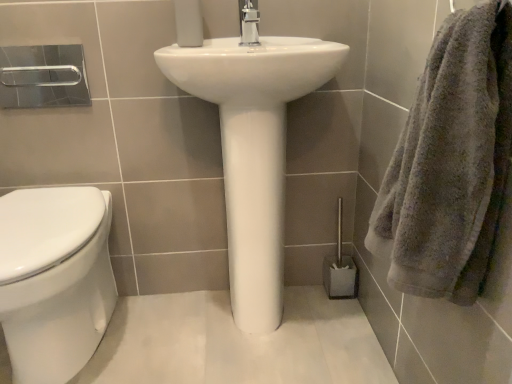
Question: Is white matte toilet paper at upper center behind white glossy toilet at left?

Choices:
 (A) yes
 (B) no

Answer: (A)

Question: Considering the relative sizes of white matte toilet paper at upper center and white glossy toilet at left in the image provided, is white matte toilet paper at upper center wider than white glossy toilet at left?

Choices:
 (A) no
 (B) yes

Answer: (A)

Question: Does white matte toilet paper at upper center turn towards white glossy toilet at left?

Choices:
 (A) yes
 (B) no

Answer: (B)

Question: From a real-world perspective, is white matte toilet paper at upper center positioned under white glossy toilet at left based on gravity?

Choices:
 (A) yes
 (B) no

Answer: (B)

Question: Considering the relative sizes of white matte toilet paper at upper center and white glossy toilet at left in the image provided, is white matte toilet paper at upper center smaller than white glossy toilet at left?

Choices:
 (A) no
 (B) yes

Answer: (B)

Question: Is point (506, 105) closer or farther from the camera than point (329, 283)?

Choices:
 (A) farther
 (B) closer

Answer: (B)

Question: From a real-world perspective, is gray fluffy towel at right physically located above or below gray plastic toilet brush at lower right?

Choices:
 (A) above
 (B) below

Answer: (A)

Question: From their relative heights in the image, would you say gray fluffy towel at right is taller or shorter than gray plastic toilet brush at lower right?

Choices:
 (A) short
 (B) tall

Answer: (B)

Question: From the image's perspective, is gray fluffy towel at right positioned above or below gray plastic toilet brush at lower right?

Choices:
 (A) above
 (B) below

Answer: (A)

Question: Is point (278, 278) closer or farther from the camera than point (420, 218)?

Choices:
 (A) farther
 (B) closer

Answer: (A)

Question: Which is correct: white glossy sink at center is inside gray fluffy towel at right, or outside of it?

Choices:
 (A) outside
 (B) inside

Answer: (A)

Question: Considering the positions of white glossy sink at center and gray fluffy towel at right in the image, is white glossy sink at center taller or shorter than gray fluffy towel at right?

Choices:
 (A) tall
 (B) short

Answer: (A)

Question: From a real-world perspective, relative to gray fluffy towel at right, is white glossy sink at center vertically above or below?

Choices:
 (A) below
 (B) above

Answer: (A)

Question: In terms of width, does white glossy toilet at left look wider or thinner when compared to white glossy sink at center?

Choices:
 (A) wide
 (B) thin

Answer: (A)

Question: Considering the positions of white glossy toilet at left and white glossy sink at center in the image, is white glossy toilet at left taller or shorter than white glossy sink at center?

Choices:
 (A) tall
 (B) short

Answer: (B)